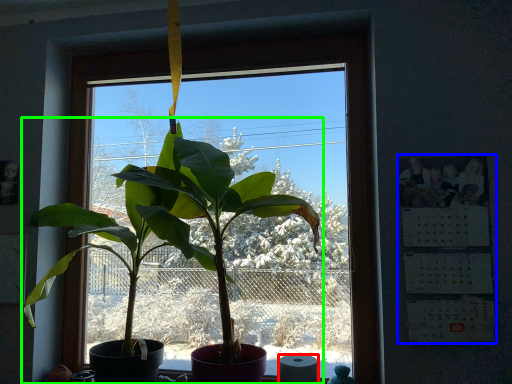
Question: Based on their relative distances, which object is farther from toilet paper (highlighted by a red box)? Choose from bulletin board (highlighted by a blue box) and houseplant (highlighted by a green box).

Choices:
 (A) bulletin board
 (B) houseplant

Answer: (B)